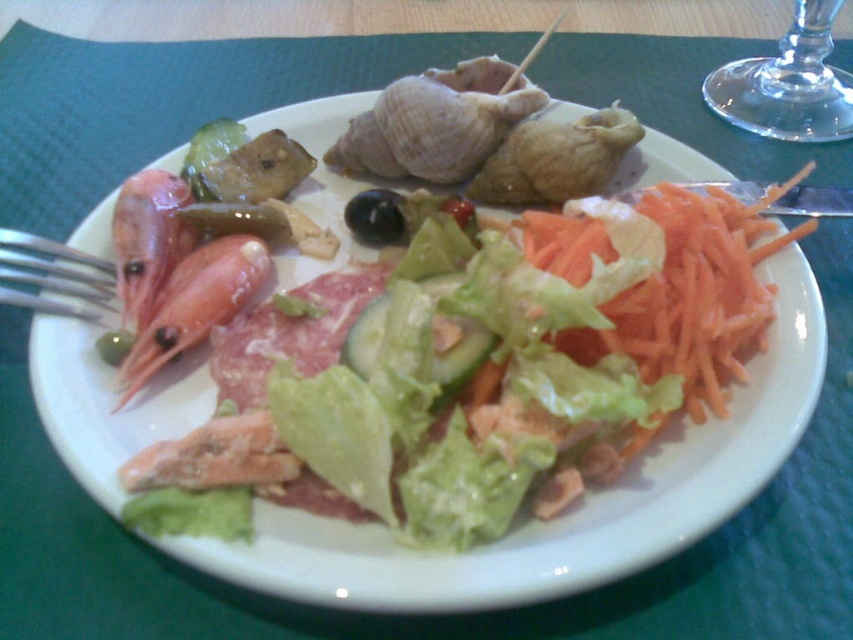
Find the location of `slightly pinkish raw meat at center`. slightly pinkish raw meat at center is located at coordinates (289, 332).

Can you confirm if slightly pinkish raw meat at center is positioned to the left of green leafy lettuce at center?

In fact, slightly pinkish raw meat at center is to the right of green leafy lettuce at center.

Is point (293, 330) in front of point (234, 506)?

No, (293, 330) is further to viewer.

Identify the location of slightly pinkish raw meat at center. Image resolution: width=853 pixels, height=640 pixels. [x=289, y=332].

Is pinkish translucent prawns at center-left above black glossy olive at center?

No.

Is pinkish translucent prawns at center-left thinner than black glossy olive at center?

Incorrect, pinkish translucent prawns at center-left's width is not less than black glossy olive at center's.

Does point (248, 244) come behind point (384, 224)?

No, (248, 244) is closer to viewer.

The width and height of the screenshot is (853, 640). I want to click on pinkish translucent prawns at center-left, so click(195, 305).

Describe the element at coordinates (190, 513) in the screenshot. I see `green leafy lettuce at center` at that location.

Between green leafy lettuce at center and black glossy olive at center, which one appears on the right side from the viewer's perspective?

Positioned to the right is black glossy olive at center.

What are the coordinates of `green leafy lettuce at center` in the screenshot? It's located at (190, 513).

Where is `green leafy lettuce at center`? Image resolution: width=853 pixels, height=640 pixels. green leafy lettuce at center is located at coordinates (190, 513).